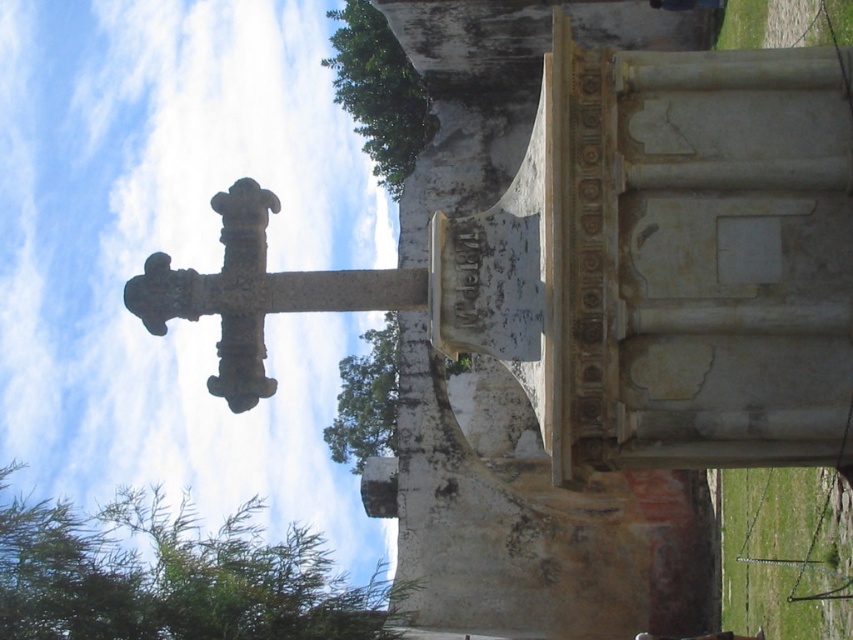
You are standing in the outdoor scene and want to know if you can reach the green leafy tree at lower left in 10 seconds if you walk at a normal pace of 1.5 meters per second. Can you make it?

The distance between you and the green leafy tree at lower left is 48.97 meters. Walking at 1.5 meters per second, it would take approximately 32.65 seconds to reach it. Therefore, you cannot reach the green leafy tree at lower left in 10 seconds.